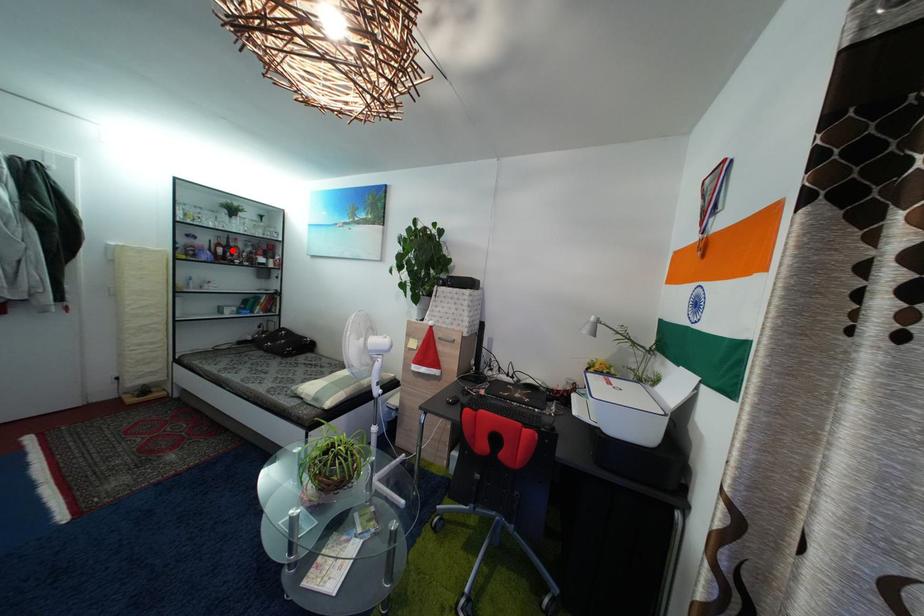
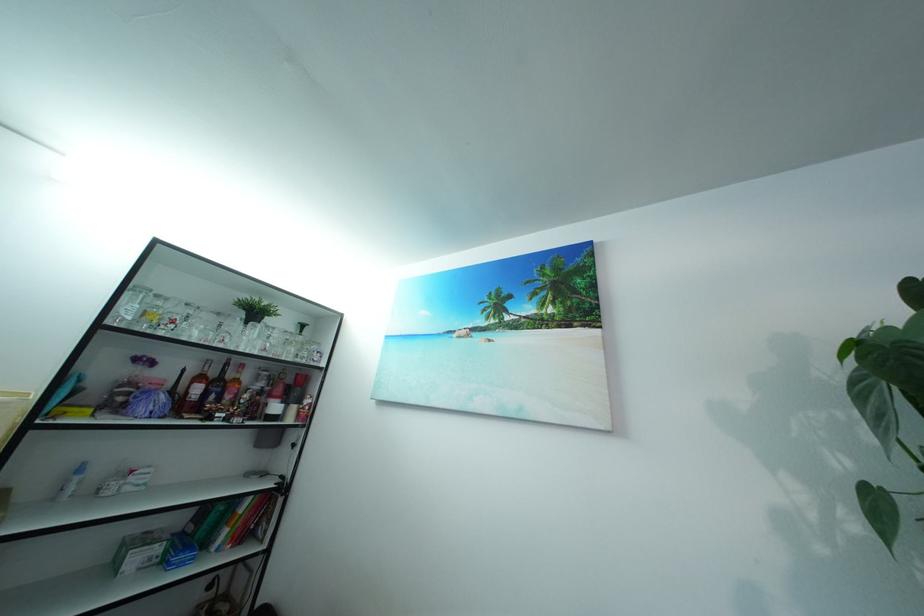
In the second image, find the point that corresponds to the highlighted location in the first image.

(222, 381)